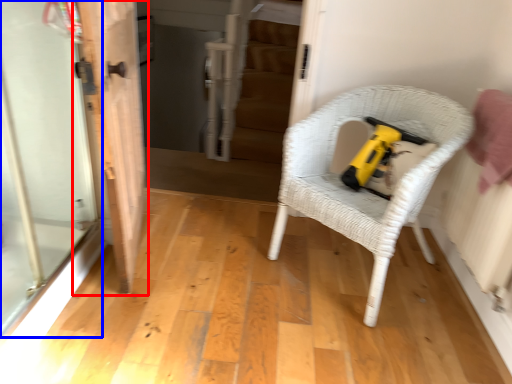
Question: Which point is closer to the camera, door (highlighted by a red box) or screen door (highlighted by a blue box)?

Choices:
 (A) door
 (B) screen door

Answer: (B)